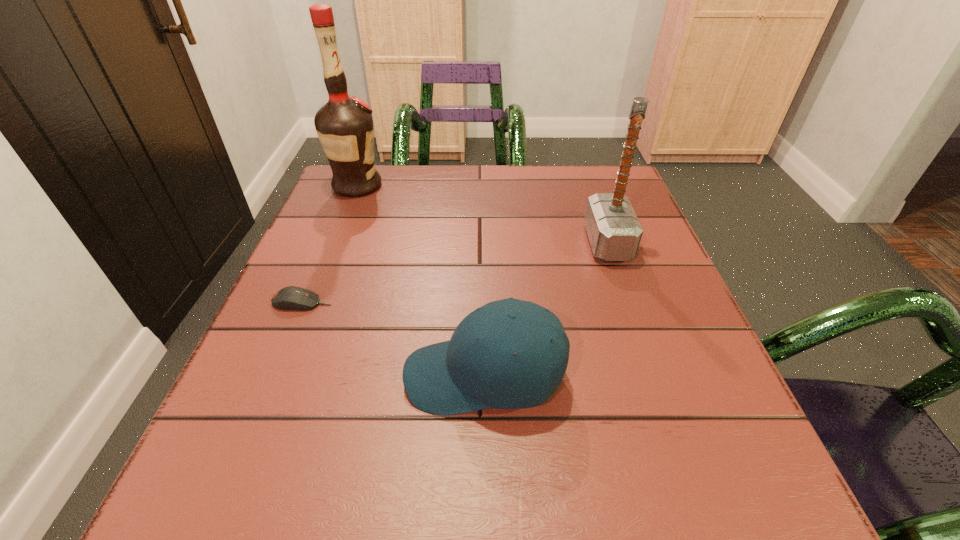
Locate an element on the screen. The width and height of the screenshot is (960, 540). vacant point located between the computer mouse and the rightmost object is located at coordinates (455, 273).

Image resolution: width=960 pixels, height=540 pixels. Identify the location of vacant space that's between the third farthest object and the second shortest object. (394, 339).

Where is `vacant region between the third farthest object and the third shortest object`? vacant region between the third farthest object and the third shortest object is located at coordinates [455, 273].

The height and width of the screenshot is (540, 960). In order to click on unoccupied area between the liquor and the nearest object in this screenshot , I will do `click(420, 281)`.

Image resolution: width=960 pixels, height=540 pixels. I want to click on empty location between the shortest object and the second farthest object, so click(455, 273).

What are the coordinates of `object that is the closest one to the tallest object` in the screenshot? It's located at (289, 298).

The width and height of the screenshot is (960, 540). I want to click on object that is the second closest one to the second nearest object, so click(344, 125).